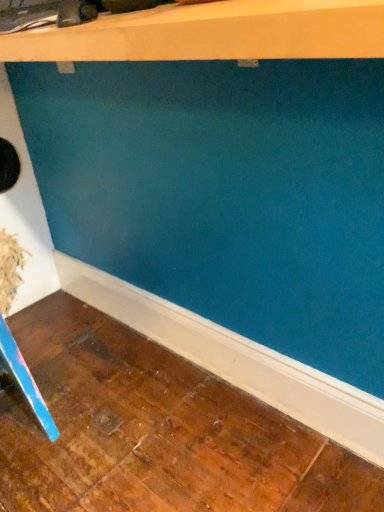
Question: From the image's perspective, is matte white shelf at upper center located above or below blue plastic ruler at lower left?

Choices:
 (A) above
 (B) below

Answer: (A)

Question: Considering the positions of point (347, 13) and point (8, 347), is point (347, 13) closer or farther from the camera than point (8, 347)?

Choices:
 (A) farther
 (B) closer

Answer: (B)

Question: Is matte white shelf at upper center taller or shorter than blue plastic ruler at lower left?

Choices:
 (A) short
 (B) tall

Answer: (A)

Question: In terms of width, does blue plastic ruler at lower left look wider or thinner when compared to matte white shelf at upper center?

Choices:
 (A) thin
 (B) wide

Answer: (A)

Question: From a real-world perspective, is blue plastic ruler at lower left above or below matte white shelf at upper center?

Choices:
 (A) above
 (B) below

Answer: (B)

Question: Which is correct: blue plastic ruler at lower left is inside matte white shelf at upper center, or outside of it?

Choices:
 (A) outside
 (B) inside

Answer: (A)

Question: Relative to matte white shelf at upper center, is blue plastic ruler at lower left in front or behind?

Choices:
 (A) behind
 (B) front

Answer: (A)